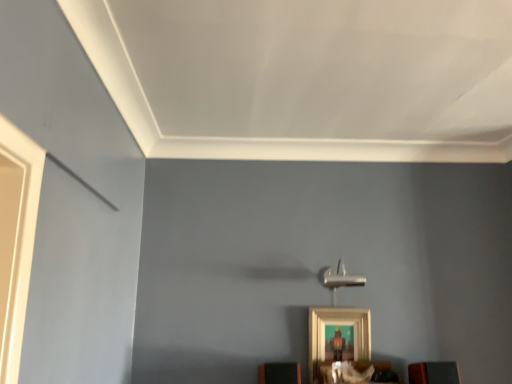
Question: Can you confirm if matte black speaker at lower right, arranged as the first furniture when viewed from the right, is positioned to the right of gold metallic picture frame at lower center?

Choices:
 (A) no
 (B) yes

Answer: (B)

Question: Is matte black speaker at lower right, which appears as the 3th furniture when viewed from the left, outside of gold metallic picture frame at lower center?

Choices:
 (A) no
 (B) yes

Answer: (B)

Question: Is matte black speaker at lower right, which appears as the 3th furniture when viewed from the left, positioned with its back to gold metallic picture frame at lower center?

Choices:
 (A) no
 (B) yes

Answer: (A)

Question: Would you consider matte black speaker at lower right, which appears as the 3th furniture when viewed from the left, to be distant from gold metallic picture frame at lower center?

Choices:
 (A) yes
 (B) no

Answer: (B)

Question: Considering the relative positions of matte black speaker at lower right, arranged as the first furniture when viewed from the right, and gold metallic picture frame at lower center in the image provided, is matte black speaker at lower right, arranged as the first furniture when viewed from the right, to the left of gold metallic picture frame at lower center from the viewer's perspective?

Choices:
 (A) no
 (B) yes

Answer: (A)

Question: Would you say gold metallic picture frame at lower center is part of matte black speaker at lower right, arranged as the first furniture when viewed from the right,'s contents?

Choices:
 (A) yes
 (B) no

Answer: (B)

Question: Is orange matte speaker at lower center, acting as the third furniture starting from the right, oriented away from gold metallic picture frame at lower center?

Choices:
 (A) no
 (B) yes

Answer: (A)

Question: Is orange matte speaker at lower center, acting as the third furniture starting from the right, aimed at gold metallic picture frame at lower center?

Choices:
 (A) yes
 (B) no

Answer: (B)

Question: From a real-world perspective, does orange matte speaker at lower center, acting as the third furniture starting from the right, stand above gold metallic picture frame at lower center?

Choices:
 (A) no
 (B) yes

Answer: (A)

Question: Is the position of orange matte speaker at lower center, acting as the third furniture starting from the right, more distant than that of gold metallic picture frame at lower center?

Choices:
 (A) yes
 (B) no

Answer: (B)

Question: Is orange matte speaker at lower center, acting as the third furniture starting from the right, to the left of gold metallic picture frame at lower center from the viewer's perspective?

Choices:
 (A) yes
 (B) no

Answer: (A)

Question: Considering the relative sizes of orange matte speaker at lower center, acting as the 1th furniture starting from the left, and gold metallic picture frame at lower center in the image provided, is orange matte speaker at lower center, acting as the 1th furniture starting from the left, shorter than gold metallic picture frame at lower center?

Choices:
 (A) yes
 (B) no

Answer: (A)

Question: Is wooden shelf at lower center, which ranks as the 2th furniture in right-to-left order, facing towards gold metallic picture frame at lower center?

Choices:
 (A) yes
 (B) no

Answer: (B)